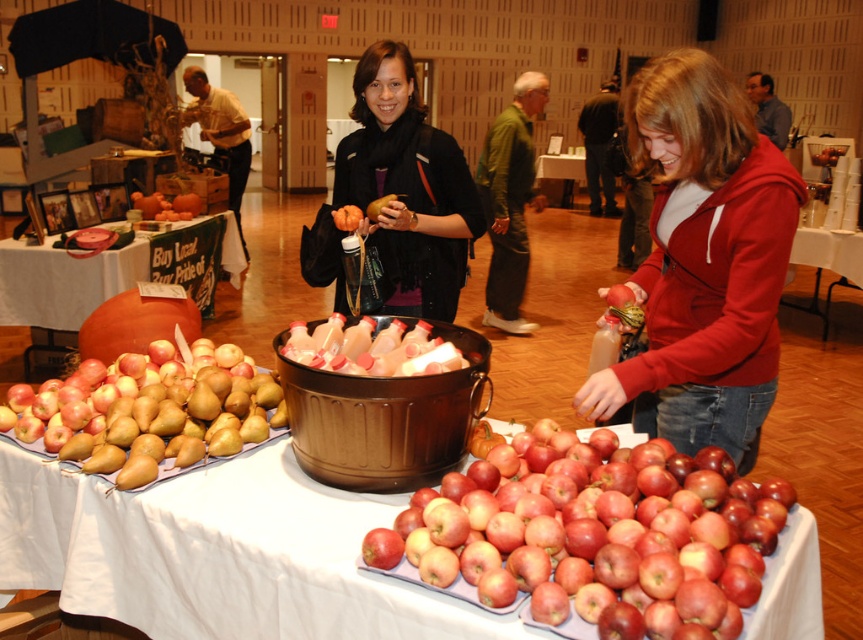
Question: Which of the following is the closest to the observer?

Choices:
 (A) shiny red apples at lower right
 (B) matte black jacket at center

Answer: (A)

Question: Does matte black jacket at center have a lesser width compared to orange matte pumpkin at center?

Choices:
 (A) yes
 (B) no

Answer: (B)

Question: Based on their relative distances, which object is farther from the white tablecloth at lower right?

Choices:
 (A) smooth orange pumpkins at center
 (B) red fleece jacket at lower right
 (C) brushed metal water at bottle left

Answer: (C)

Question: Can you confirm if matte black jacket at center is positioned below smooth brown leather jacket at upper center?

Choices:
 (A) no
 (B) yes

Answer: (B)

Question: Is dark green jacket at center positioned in front of smooth orange pumpkins at center?

Choices:
 (A) yes
 (B) no

Answer: (B)

Question: Which point is closer to the camera?

Choices:
 (A) smooth orange pumpkins at center
 (B) red fleece jacket at lower right
 (C) white tablecloth at lower right
 (D) golden brown pear at lower left

Answer: (D)